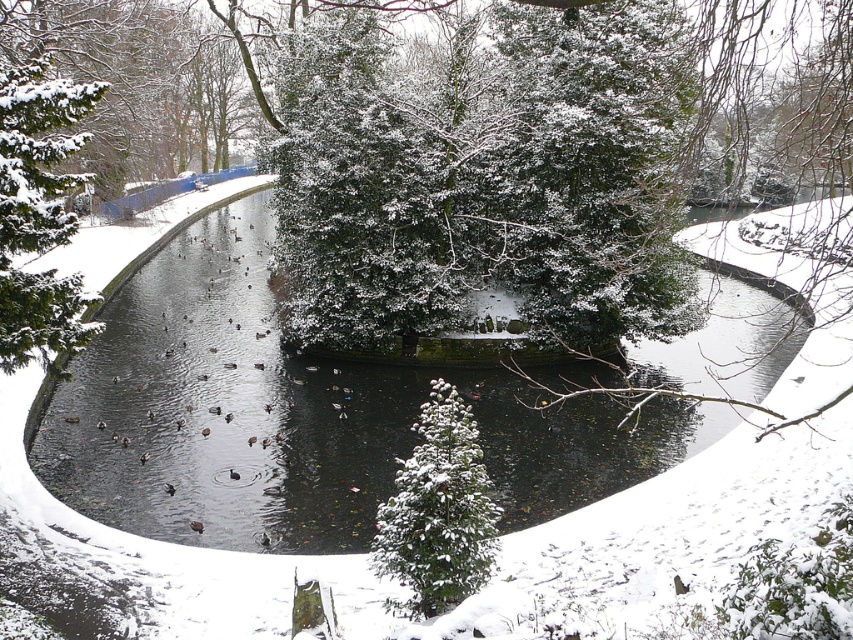
Who is more distant from viewer, (42, 468) or (33, 192)?

Point (42, 468)

Who is higher up, black water at center or green matte tree at left?

green matte tree at left is above.

Does point (675, 352) come closer to viewer compared to point (13, 148)?

That is False.

The height and width of the screenshot is (640, 853). What are the coordinates of `black water at center` in the screenshot? It's located at (299, 417).

Looking at this image, between black water at center and snow-covered evergreen tree at center, which one has more height?

With more height is black water at center.

From the picture: Who is more distant from viewer, [369,385] or [437,579]?

Positioned behind is point [369,385].

Locate an element on the screen. The height and width of the screenshot is (640, 853). black water at center is located at coordinates (299, 417).

Who is more forward, (65, 176) or (483, 573)?

Point (483, 573)

Is green matte tree at left to the left of snow-covered evergreen tree at center from the viewer's perspective?

Indeed, green matte tree at left is positioned on the left side of snow-covered evergreen tree at center.

Is point (16, 140) behind point (430, 616)?

Yes, point (16, 140) is farther from viewer.

Identify the location of green matte tree at left. (38, 211).